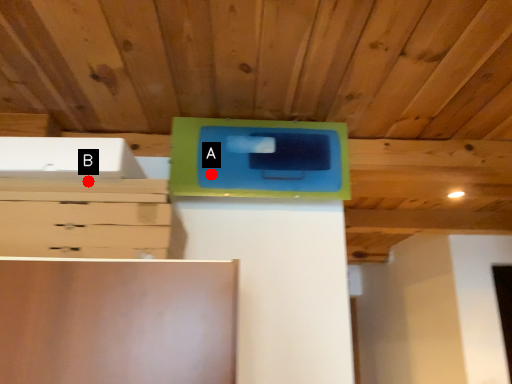
Question: Two points are circled on the image, labeled by A and B beside each circle. Which point is farther from the camera taking this photo?

Choices:
 (A) A is further
 (B) B is further

Answer: (A)